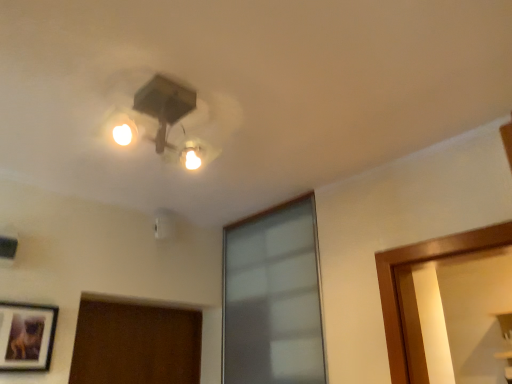
Question: From their relative heights in the image, would you say matte black picture frame at lower left is taller or shorter than frosted glass window at center?

Choices:
 (A) short
 (B) tall

Answer: (A)

Question: In terms of width, does matte black picture frame at lower left look wider or thinner when compared to frosted glass window at center?

Choices:
 (A) wide
 (B) thin

Answer: (B)

Question: Based on their relative distances, which object is farther from the matte black picture frame at lower left?

Choices:
 (A) matte black fixture at upper center
 (B) frosted glass window at center

Answer: (B)

Question: Estimate the real-world distances between objects in this image. Which object is closer to the matte black picture frame at lower left?

Choices:
 (A) frosted glass window at center
 (B) matte black fixture at upper center

Answer: (B)